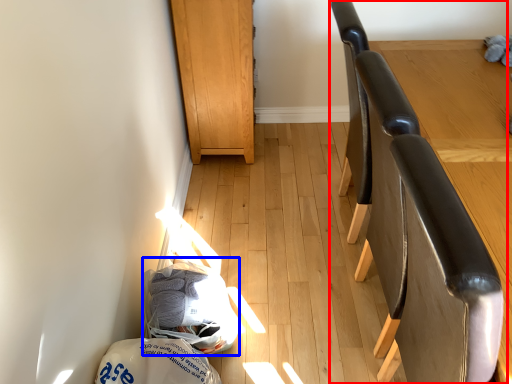
Question: Which object is closer to the camera taking this photo, chair (highlighted by a red box) or material (highlighted by a blue box)?

Choices:
 (A) chair
 (B) material

Answer: (A)